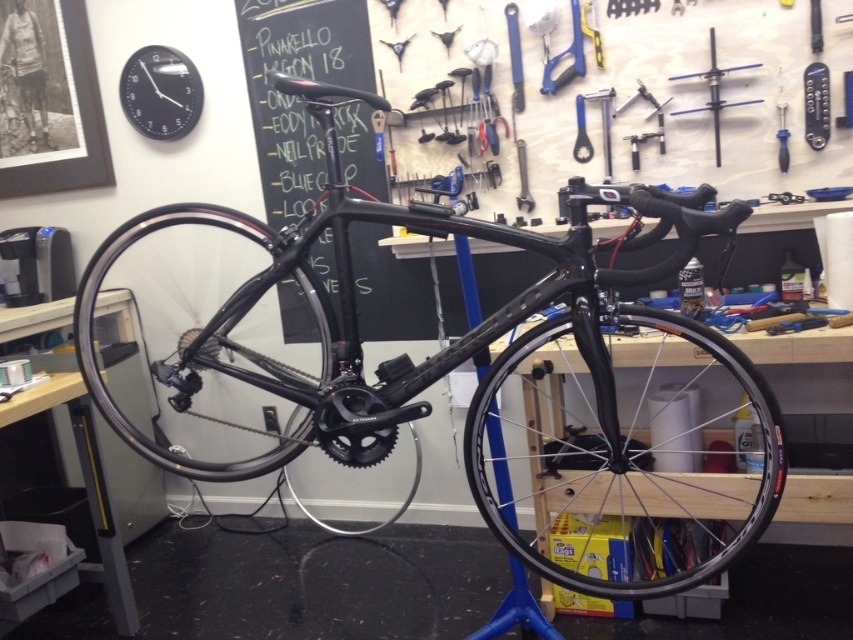
Question: Estimate the real-world distances between objects in this image. Which object is farther from the black carbon fiber wheel at center?

Choices:
 (A) glossy carbon fiber wheel at center
 (B) metallic silver wrench at upper right
 (C) blue metallic screwdriver at upper center

Answer: (A)

Question: Can you confirm if glossy carbon fiber wheel at center is positioned to the left of black matte chalkboard at center?

Choices:
 (A) no
 (B) yes

Answer: (B)

Question: Can you confirm if black carbon fiber wheel at center is thinner than metallic silver wrench at upper right?

Choices:
 (A) no
 (B) yes

Answer: (A)

Question: Is black carbon fiber wheel at center smaller than glossy carbon fiber wheel at center?

Choices:
 (A) yes
 (B) no

Answer: (B)

Question: Which object is farther from the camera taking this photo?

Choices:
 (A) blue plastic screwdriver at upper right
 (B) glossy carbon fiber bicycle at center

Answer: (A)

Question: Which of the following is the farthest from the observer?

Choices:
 (A) (178, 454)
 (B) (709, 84)
 (C) (288, 324)
 (D) (711, 564)

Answer: (A)